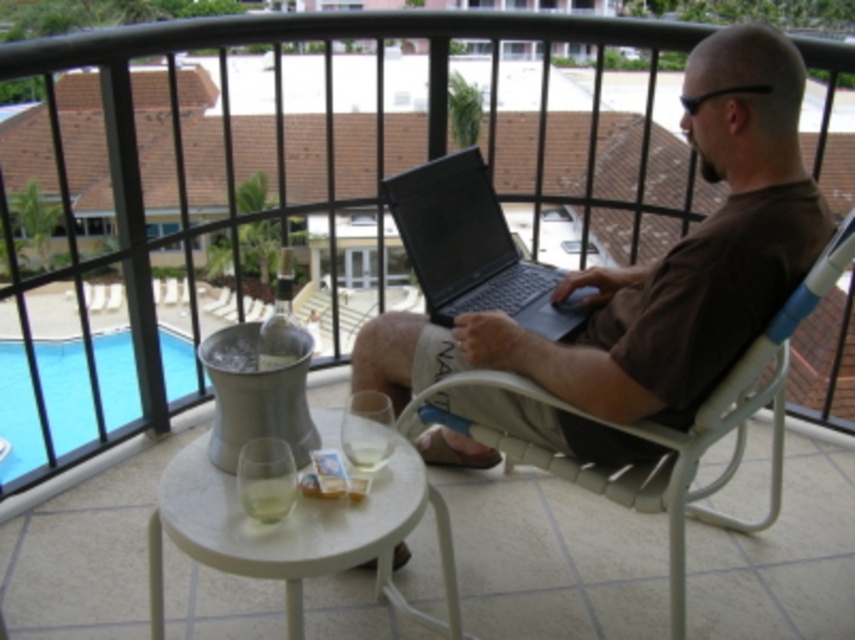
What do you see at coordinates (658, 264) in the screenshot? I see `brown cotton shirt at center` at bounding box center [658, 264].

Who is more distant from viewer, [805,202] or [463,150]?

Positioned behind is point [463,150].

Does point (820, 227) come in front of point (496, 301)?

Yes.

Where is `brown cotton shirt at center`? The height and width of the screenshot is (640, 855). brown cotton shirt at center is located at coordinates (658, 264).

Does brown cotton shirt at center appear under blue glass at lower left?

No, brown cotton shirt at center is not below blue glass at lower left.

Between point (702, 372) and point (42, 472), which one is positioned in front?

Point (702, 372) is more forward.

You are a GUI agent. You are given a task and a screenshot of the screen. Output one action in this format:
    pyautogui.click(x=<x>, y=<y>)
    Task: Click on the brown cotton shirt at center
    
    Given the screenshot: What is the action you would take?
    pyautogui.click(x=658, y=264)

Is white woven plastic chair at center closer to the viewer compared to blue glass at lower left?

Yes, white woven plastic chair at center is in front of blue glass at lower left.

Who is more distant from viewer, (x=620, y=428) or (x=107, y=408)?

The point (x=107, y=408) is behind.

The height and width of the screenshot is (640, 855). I want to click on white woven plastic chair at center, so [x=682, y=432].